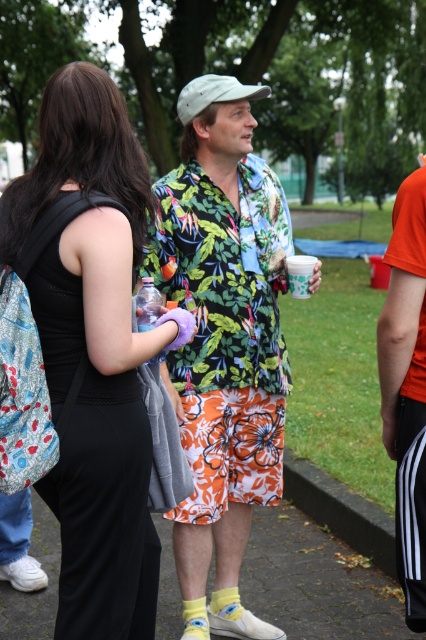
Question: Observing the image, what is the correct spatial positioning of black fabric dress at center in reference to floral print shirt at center?

Choices:
 (A) right
 (B) left

Answer: (B)

Question: Which point appears farthest from the camera in this image?

Choices:
 (A) (186, 115)
 (B) (169, 360)
 (C) (54, 109)

Answer: (A)

Question: Which of the following is the closest to the observer?

Choices:
 (A) (186, 124)
 (B) (75, 248)

Answer: (B)

Question: Which object is closer to the camera taking this photo?

Choices:
 (A) black fabric dress at center
 (B) light gray fabric baseball cap at upper center

Answer: (A)

Question: Does black fabric dress at center have a lesser width compared to floral print shirt at center?

Choices:
 (A) yes
 (B) no

Answer: (A)

Question: Does black fabric dress at center appear on the left side of floral print shirt at center?

Choices:
 (A) no
 (B) yes

Answer: (B)